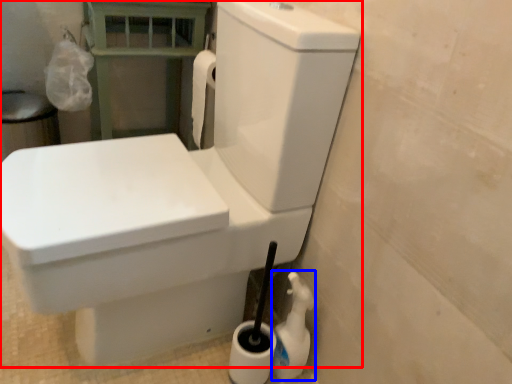
Question: Among these objects, which one is nearest to the camera, toilet (highlighted by a red box) or cleaning product (highlighted by a blue box)?

Choices:
 (A) toilet
 (B) cleaning product

Answer: (A)